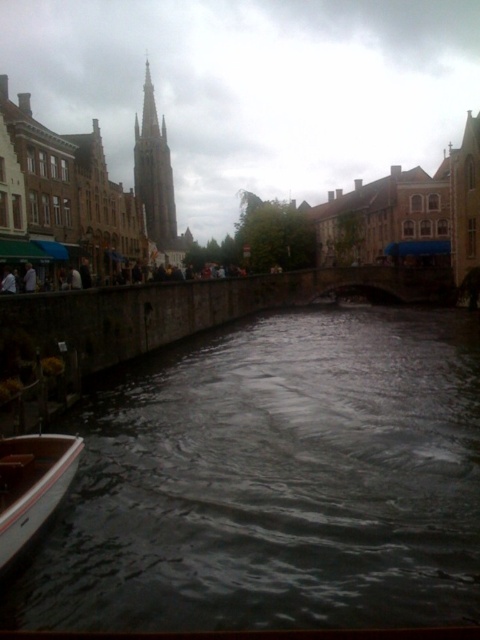
Question: Is dark gray water at lower center below brown stone tower at center?

Choices:
 (A) no
 (B) yes

Answer: (B)

Question: Which of the following is the farthest from the observer?

Choices:
 (A) dark gray water at lower center
 (B) white wood boat at lower left

Answer: (B)

Question: Which point is closer to the camera taking this photo?

Choices:
 (A) (157, 157)
 (B) (59, 451)

Answer: (B)

Question: Does white wood boat at lower left appear over brown stone tower at center?

Choices:
 (A) yes
 (B) no

Answer: (B)

Question: Can you confirm if dark gray water at lower center is positioned below white wood boat at lower left?

Choices:
 (A) no
 (B) yes

Answer: (A)

Question: Which point appears farthest from the camera in this image?

Choices:
 (A) (169, 225)
 (B) (48, 484)
 (C) (204, 563)

Answer: (A)